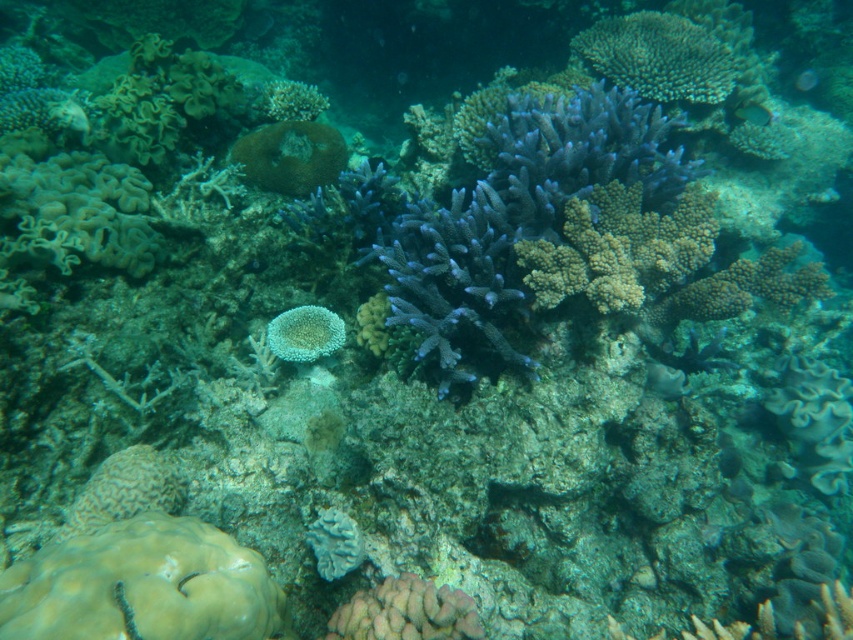
Question: Which is farther from the yellow matte coral at lower left?

Choices:
 (A) translucent blue fish at upper right
 (B) smooth pink coral at center
 (C) white porous coral at lower center
 (D) rough textured coral at upper right

Answer: (A)

Question: Which object is the farthest from the rough textured coral at upper right?

Choices:
 (A) translucent blue fish at upper right
 (B) shiny blue fish at upper right

Answer: (A)

Question: Can you confirm if smooth pink coral at center is positioned to the left of white matte coral at center?

Choices:
 (A) no
 (B) yes

Answer: (A)

Question: In this image, where is shiny blue fish at upper right located relative to translucent blue fish at upper right?

Choices:
 (A) below
 (B) above

Answer: (A)

Question: Which point is farther to the camera?

Choices:
 (A) (757, 124)
 (B) (444, 602)
 (C) (320, 340)
 (D) (331, 572)

Answer: (A)

Question: Where is rough textured coral at upper right located in relation to white porous coral at lower center in the image?

Choices:
 (A) above
 (B) below

Answer: (A)